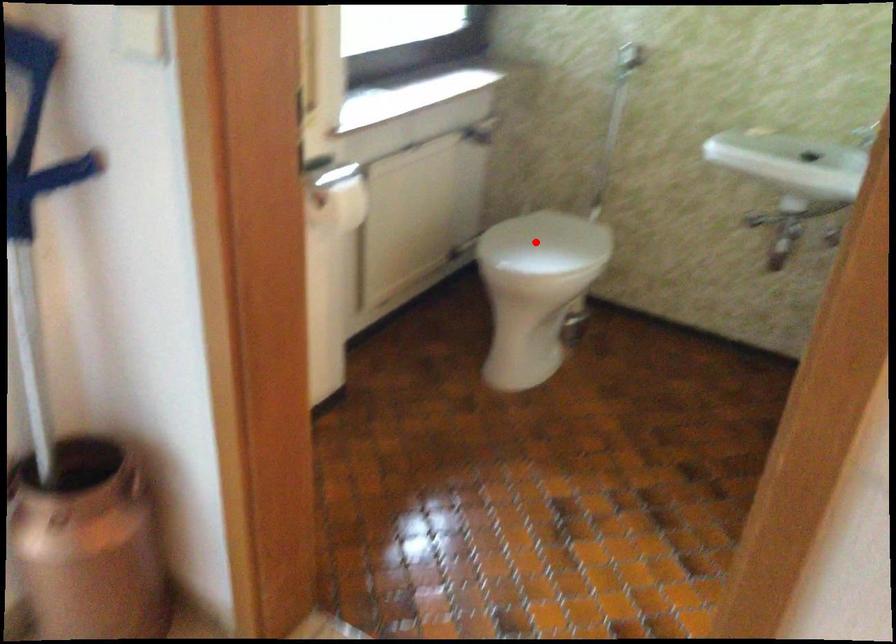
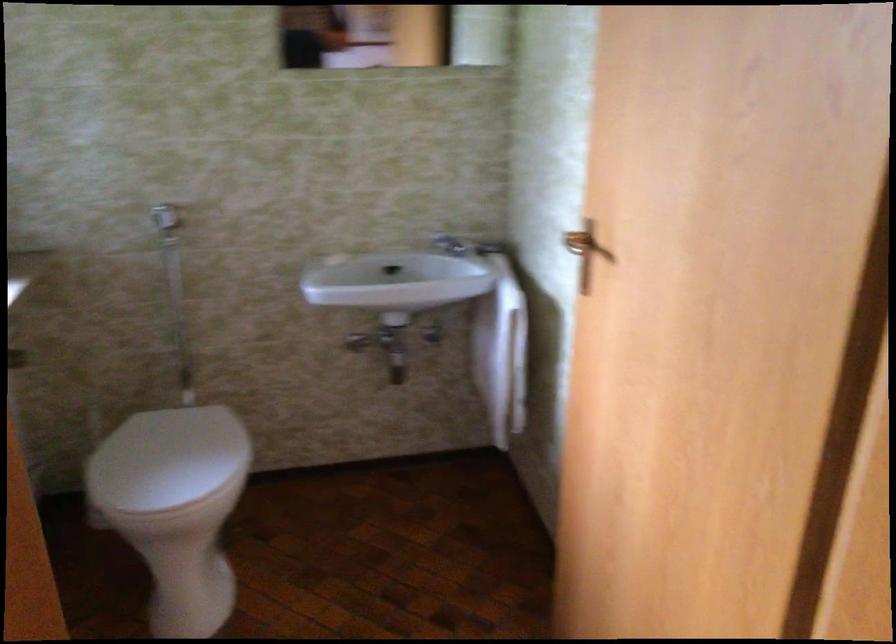
Question: I am providing you with two images of the same scene from different viewpoints. A red point is shown in image1. For the corresponding object point in image2, is it positioned nearer or farther from the camera?

Choices:
 (A) Nearer
 (B) Farther

Answer: (A)